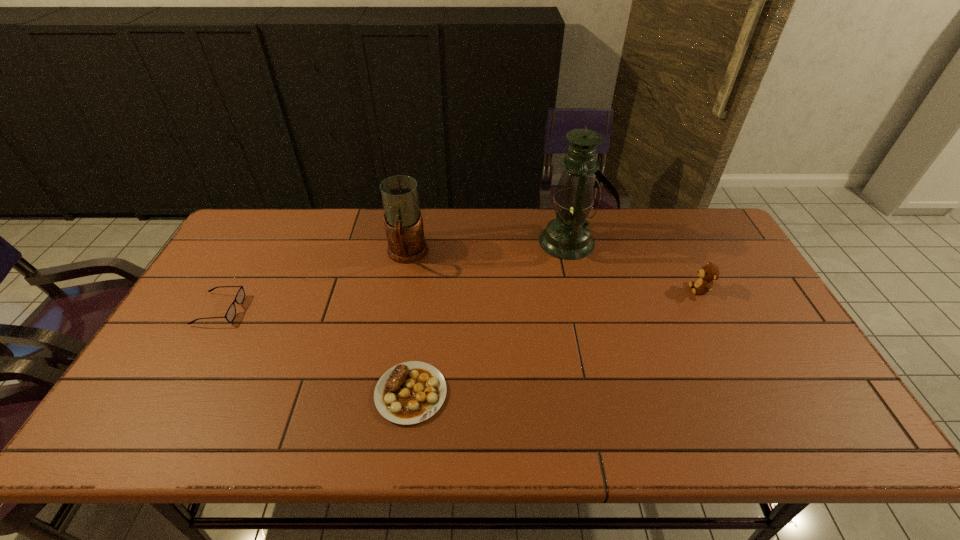
Locate an element on the screen. This screenshot has width=960, height=540. unoccupied position between the leftmost object and the tallest object is located at coordinates (393, 275).

Locate an element on the screen. This screenshot has width=960, height=540. free space between the spectacles and the second object from right to left is located at coordinates (393, 275).

You are a GUI agent. You are given a task and a screenshot of the screen. Output one action in this format:
    pyautogui.click(x=<x>, y=<y>)
    Task: Click on the vacant space in between the spectacles and the fourth shortest object
    The width and height of the screenshot is (960, 540).
    Given the screenshot: What is the action you would take?
    pyautogui.click(x=313, y=282)

The image size is (960, 540). Identify the location of vacant area that lies between the pitcher and the teddy bear. point(554,272).

Identify the location of vacant space that's between the tallest object and the shortest object. (489, 318).

Locate an element on the screen. This screenshot has height=540, width=960. free space that is in between the shortest object and the pitcher is located at coordinates (409, 324).

Locate an element on the screen. object that is the fourth nearest to the rightmost object is located at coordinates (240, 296).

The height and width of the screenshot is (540, 960). I want to click on object that is the fourth closest one to the shortest object, so pyautogui.click(x=708, y=273).

Identify the location of free space that satisfies the following two spatial constraints: 1. on the front-facing side of the shortest object; 2. on the left side of the leftmost object. click(x=172, y=393).

Identify the location of vacant point that satisfies the following two spatial constraints: 1. with the handle on the side of the pitcher; 2. on the front-facing side of the leftmost object. This screenshot has width=960, height=540. (397, 309).